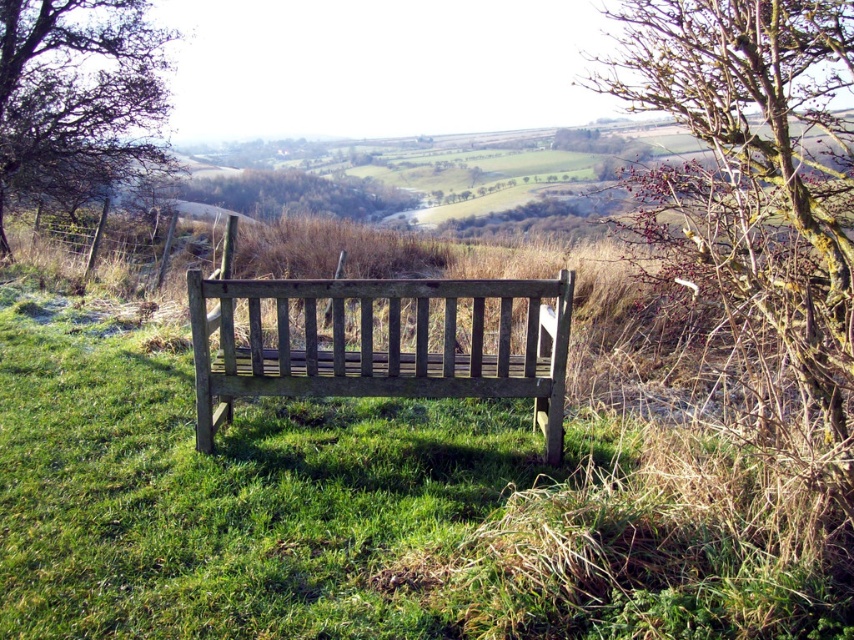
Between brown textured tree at upper left and green leafy tree at center, which one is positioned higher?

brown textured tree at upper left

Does point (4, 131) come closer to viewer compared to point (308, 192)?

Yes, point (4, 131) is in front of point (308, 192).

Who is more distant from viewer, [31,108] or [355,196]?

The point [355,196] is behind.

The width and height of the screenshot is (854, 640). What are the coordinates of `brown textured tree at upper left` in the screenshot? It's located at (77, 99).

I want to click on wooden bench at center, so click(385, 346).

Measure the distance between point (x=401, y=298) and camera.

The distance of point (x=401, y=298) from camera is 12.96 feet.

Image resolution: width=854 pixels, height=640 pixels. What are the coordinates of `wooden bench at center` in the screenshot? It's located at (385, 346).

Which is behind, point (354, 378) or point (114, 154)?

Point (114, 154)

Is wooden bench at center thinner than brown textured tree at upper left?

Yes, wooden bench at center is thinner than brown textured tree at upper left.

Between point (420, 304) and point (10, 51), which one is positioned in front?

Point (420, 304)

The width and height of the screenshot is (854, 640). What are the coordinates of `wooden bench at center` in the screenshot? It's located at (385, 346).